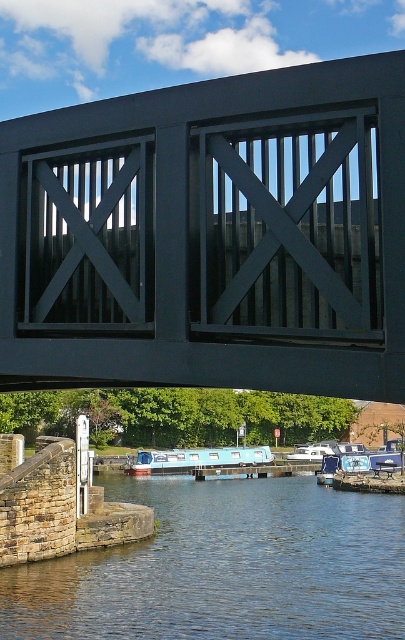
You are a delivery drone with a maximum flight range of 100 meters. You need to deliver a package from the matte black gate at center to the light blue plastic boat at center. Can you complete the delivery without needing to recharge?

The distance between the matte black gate at center and the light blue plastic boat at center is 98.44 meters, which is within your 100 meter range. Yes, you can complete the delivery without needing to recharge.

You are standing at the origin point of the image. Looking at the smooth concrete river at lower center, can you tell me its 2D coordinates in the image?

The 2D coordinates of the smooth concrete river at lower center are at point (x=225, y=566).

You are a delivery person needing to pass through the matte black gate at center with a cart that is 1.5 meters wide. Can your cart fit through the gate if the light blue plastic boat at center is currently docked nearby?

The matte black gate at center is narrower than the light blue plastic boat at center. Since the boat is docked nearby, it might block the gate. However, the gate width is less than the boat, so even if unobstructed, the cart may not fit. Check the exact measurements before proceeding.